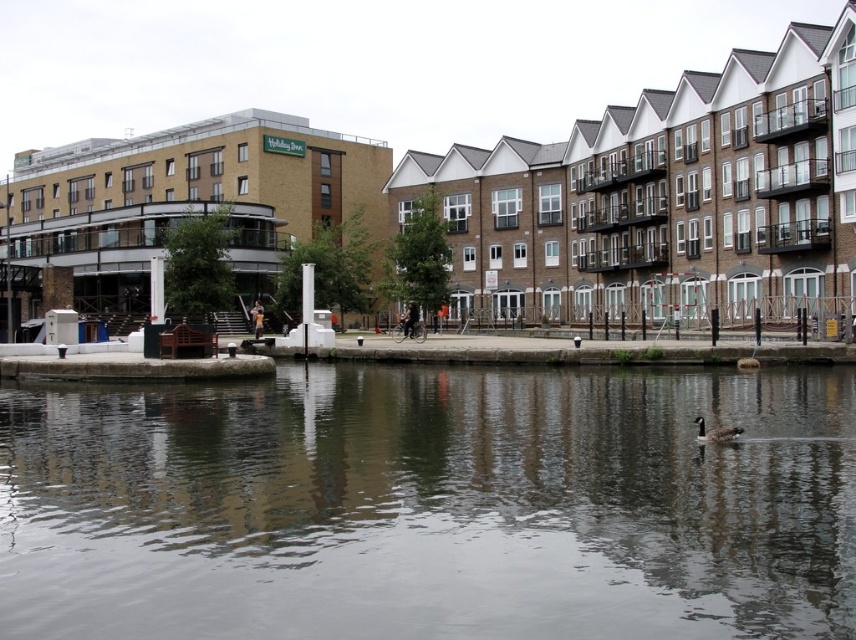
You are a photographer standing at the riverside and want to capture both the smooth concrete water at center and the brown matte duck at lower center in the same frame. Which object should you position closer to the left side of your camera viewfinder to include both in the shot?

To include both the smooth concrete water at center and the brown matte duck at lower center in the same frame, you should position the smooth concrete water at center closer to the left side of your camera viewfinder since it is already on the left side of the duck.